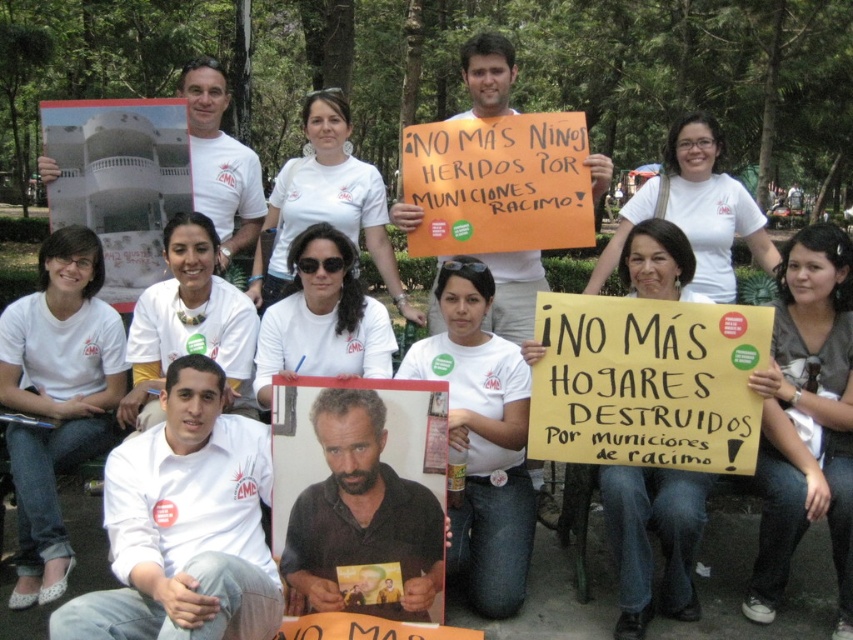
You are a photographer standing in the park where the demonstration is taking place. You want to capture a clear photo of the matte cardboard placard at center without any obstructions. Given your current position, is the distance sufficient to ensure the placard is in focus and not blurry? Please explain your reasoning based on standard camera focusing ranges.

The matte cardboard placard at center is 9.52 feet away from the viewer. Standard camera focusing ranges typically start around 3 feet and extend to infinity, so 9.52 feet is well within the focusing range. Therefore, the distance is sufficient to capture a clear, non blurry photo of the matte cardboard placard at center.

You are a photographer at the protest who wants to capture a photo of the matte cardboard placard at center and the white fabric shirt at lower left. From the perspective of the camera, which object is on the right side?

The matte cardboard placard at center is positioned on the right side of the white fabric shirt at lower left, so from the camera perspective, the matte cardboard placard at center is on the right side.